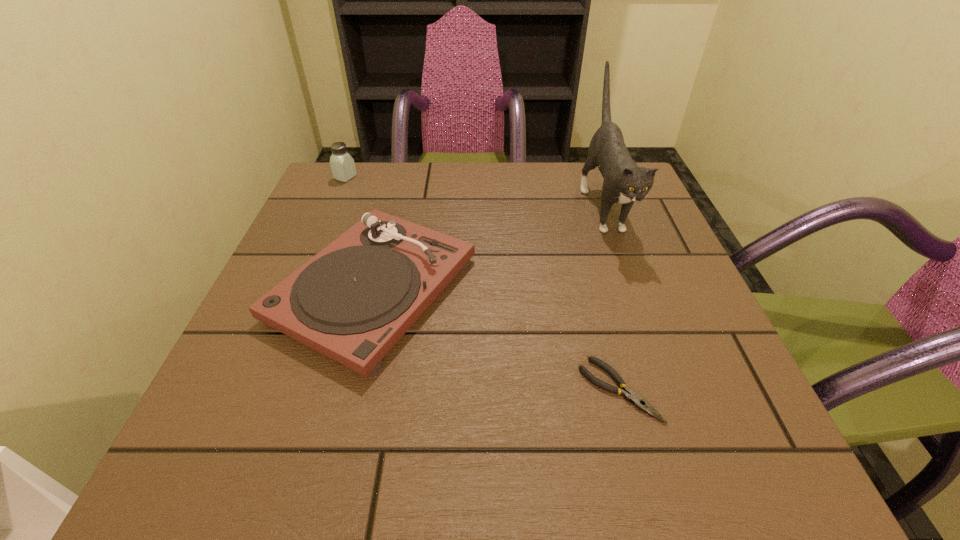
I want to click on vacant space at the right edge of the desktop, so click(x=762, y=422).

This screenshot has width=960, height=540. In the image, there is a desktop. In order to click on vacant space at the far left corner in this screenshot , I will do click(x=314, y=190).

In order to click on free point at the far right corner in this screenshot , I will do `click(596, 178)`.

Where is `vacant space at the near right corner`? The width and height of the screenshot is (960, 540). vacant space at the near right corner is located at coordinates (707, 435).

At what (x,y) coordinates should I click in order to perform the action: click on vacant point located between the shortest object and the phonograph_record. Please return your answer as a coordinate pair (x, y). This screenshot has height=540, width=960. Looking at the image, I should click on click(x=496, y=340).

The image size is (960, 540). I want to click on vacant space that is in between the shortest object and the phonograph_record, so click(x=496, y=340).

You are a GUI agent. You are given a task and a screenshot of the screen. Output one action in this format:
    pyautogui.click(x=<x>, y=<y>)
    Task: Click on the vacant space in between the pliers and the phonograph_record
    The width and height of the screenshot is (960, 540).
    Given the screenshot: What is the action you would take?
    (x=496, y=340)

This screenshot has width=960, height=540. I want to click on vacant point located between the phonograph_record and the tallest object, so click(489, 247).

This screenshot has height=540, width=960. Find the location of `free space that is in between the tallest object and the saltshaker`. free space that is in between the tallest object and the saltshaker is located at coordinates (474, 191).

Where is `empty space that is in between the pliers and the phonograph_record`? The image size is (960, 540). empty space that is in between the pliers and the phonograph_record is located at coordinates (496, 340).